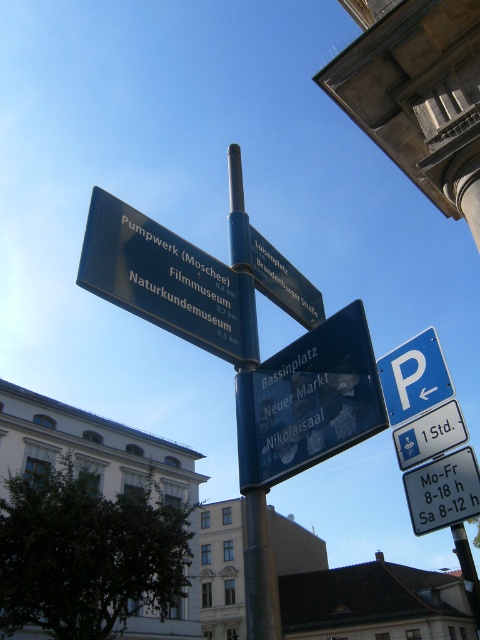
You are standing at the point with coordinates [309,401] on the image. What object are you looking at?

The point corresponds to the transparent plastic sign at center.